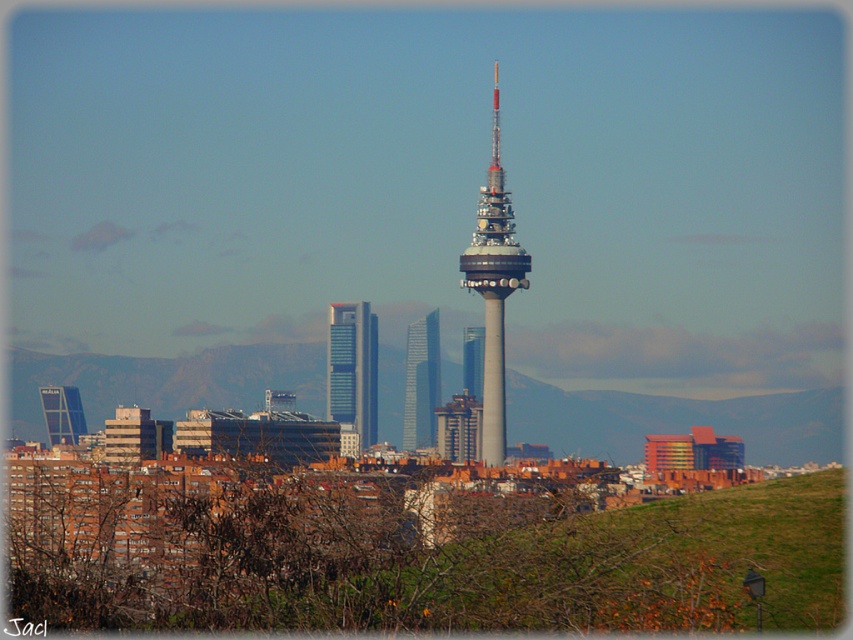
You are an architect analyzing the cityscape. You notice two skyscrapers at the center of the image. The silver glass skyscraper at center and the matte glass skyscraper at center. Based on their appearance, which one do you think is narrower?

The silver glass skyscraper at center is narrower than the matte glass skyscraper at center because it has a lesser width compared to it.